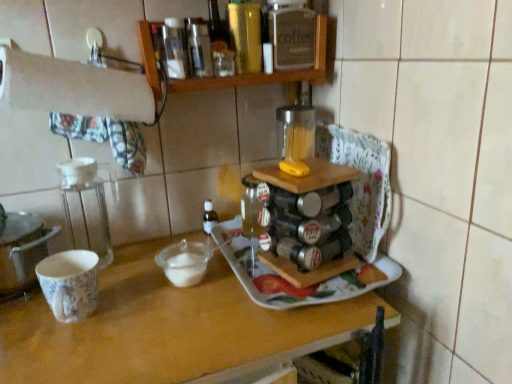
Find the location of `empty space that is in between transparent glass mixing bowl at center and white ceramic tray at center`. empty space that is in between transparent glass mixing bowl at center and white ceramic tray at center is located at coordinates (210, 294).